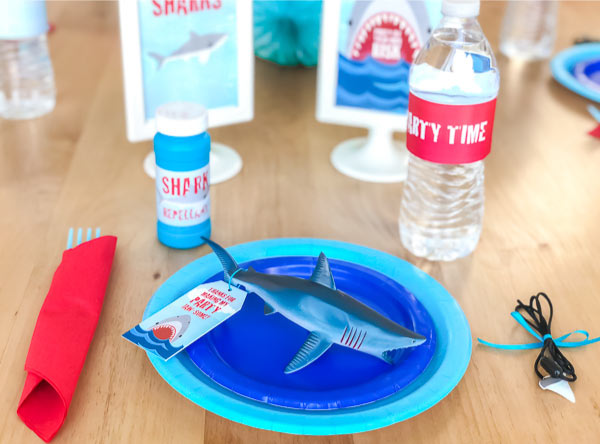
You are a GUI agent. You are given a task and a screenshot of the screen. Output one action in this format:
    pyautogui.click(x=<x>, y=<y>)
    Task: Click on the toy shark on plate
    
    Given the screenshot: What is the action you would take?
    pyautogui.click(x=359, y=323)